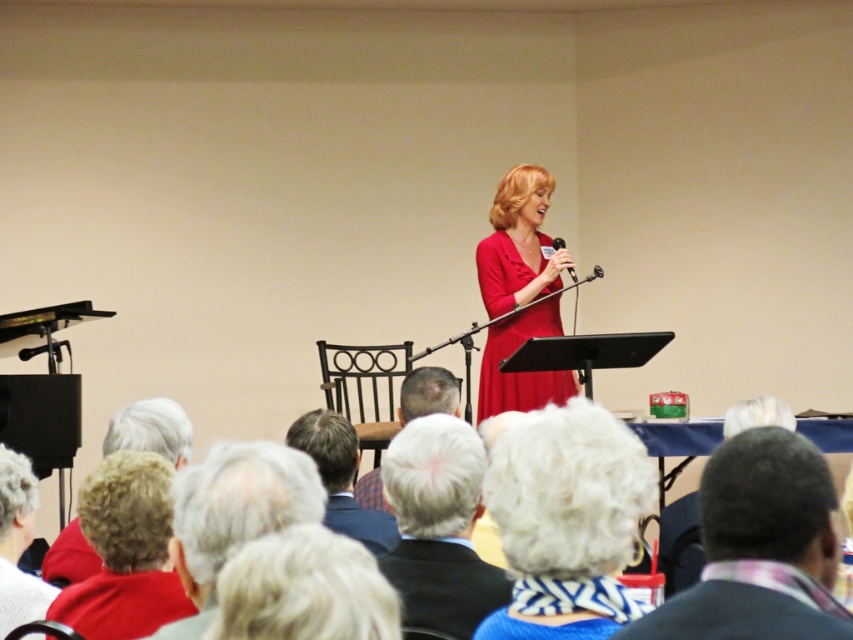
Question: Considering the relative positions of gray hair at lower left and metallic silver microphone at center in the image provided, where is gray hair at lower left located with respect to metallic silver microphone at center?

Choices:
 (A) left
 (B) right

Answer: (A)

Question: Where is gray hair at lower left located in relation to metallic silver microphone at center in the image?

Choices:
 (A) below
 (B) above

Answer: (A)

Question: Which point is closer to the camera?

Choices:
 (A) gray hair at lower left
 (B) blonde hair at center

Answer: (B)

Question: Which object is the closest to the plaid fabric shirt at lower right?

Choices:
 (A) curly blonde hair at lower left
 (B) gray hair at lower left
 (C) gray hair at center

Answer: (B)

Question: Which of the following is the farthest from the observer?

Choices:
 (A) [x=445, y=384]
 (B) [x=550, y=241]
 (C) [x=544, y=570]

Answer: (B)

Question: Does gray hair at center come behind metallic silver microphone at center?

Choices:
 (A) yes
 (B) no

Answer: (B)